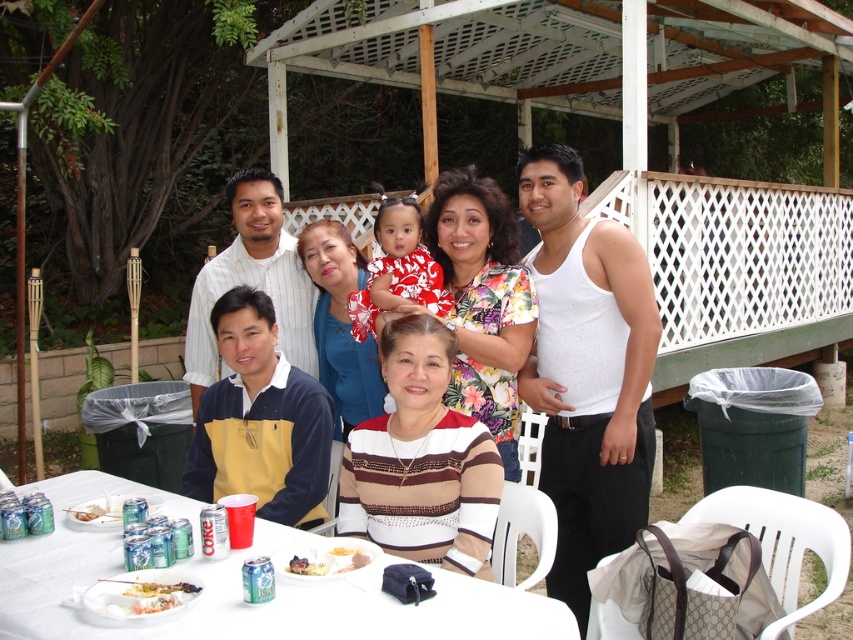
Between printed fabric dress at center and white creamy dessert at lower center, which one appears on the right side from the viewer's perspective?

From the viewer's perspective, printed fabric dress at center appears more on the right side.

Can you confirm if printed fabric dress at center is positioned to the left of white creamy dessert at lower center?

Incorrect, printed fabric dress at center is not on the left side of white creamy dessert at lower center.

Identify the location of printed fabric dress at center. (403, 264).

The height and width of the screenshot is (640, 853). I want to click on printed fabric dress at center, so click(403, 264).

Which is more to the right, white cotton tank top at right or printed fabric dress at center?

white cotton tank top at right is more to the right.

Who is more forward, [653,436] or [434,268]?

Positioned in front is point [653,436].

Locate an element on the screen. white cotton tank top at right is located at coordinates (587, 371).

Which is above, white creamy cake at lower center or white creamy dessert at lower center?

white creamy dessert at lower center

Can you confirm if white creamy cake at lower center is taller than white creamy dessert at lower center?

Correct, white creamy cake at lower center is much taller as white creamy dessert at lower center.

The image size is (853, 640). What do you see at coordinates (306, 566) in the screenshot?
I see `white creamy cake at lower center` at bounding box center [306, 566].

This screenshot has height=640, width=853. Identify the location of white creamy cake at lower center. (306, 566).